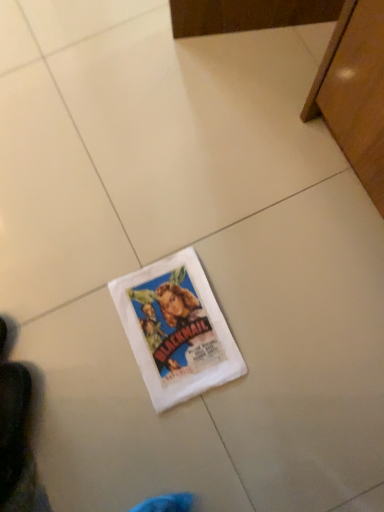
Locate an element on the screen. This screenshot has width=384, height=512. blank space above white paper flyer at center (from a real-world perspective) is located at coordinates (173, 326).